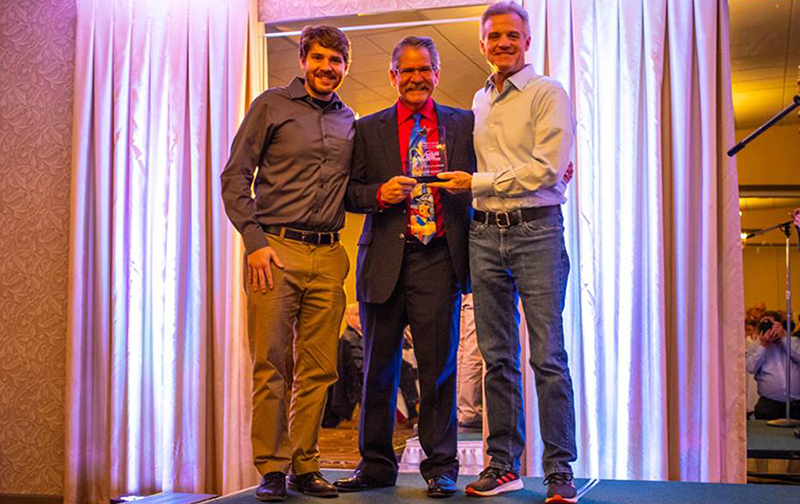
I want to click on curtains, so click(626, 201), click(200, 226).